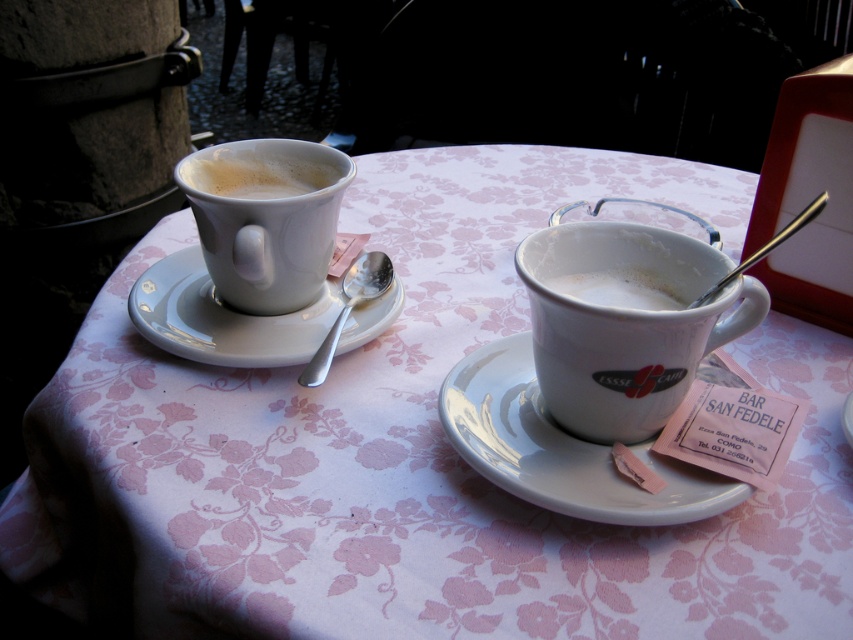
Question: Which object is the farthest from the white glossy mug at center?

Choices:
 (A) matte white cup at upper left
 (B) silver metallic spoon at left
 (C) white glossy saucer at left
 (D) white matte cup at center

Answer: (A)

Question: Which point appears closest to the camera in this image?

Choices:
 (A) (283, 172)
 (B) (511, 394)
 (C) (572, 273)

Answer: (C)

Question: Does white ceramic saucer at center have a lesser width compared to matte white cup at upper left?

Choices:
 (A) yes
 (B) no

Answer: (B)

Question: Which object is positioned closest to the white glossy saucer at left?

Choices:
 (A) silver metallic spoon at left
 (B) white matte cup at center

Answer: (A)

Question: Can you confirm if white glossy mug at center is thinner than silver metallic spoon at left?

Choices:
 (A) no
 (B) yes

Answer: (A)

Question: Does white glossy saucer at left appear on the left side of silver metallic spoon at left?

Choices:
 (A) yes
 (B) no

Answer: (A)